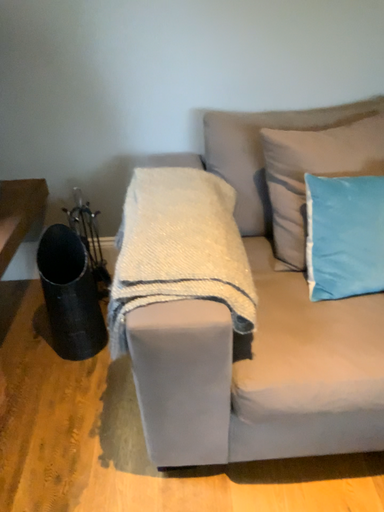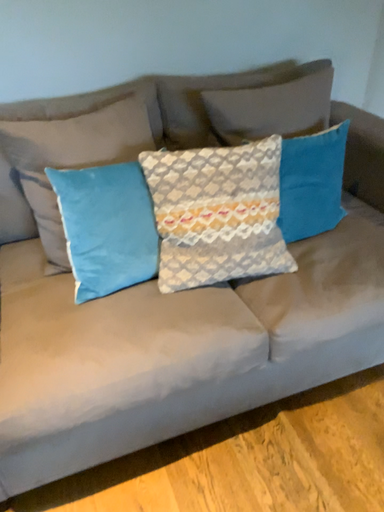
Question: Which way did the camera rotate in the video?

Choices:
 (A) rotated right
 (B) rotated left

Answer: (A)